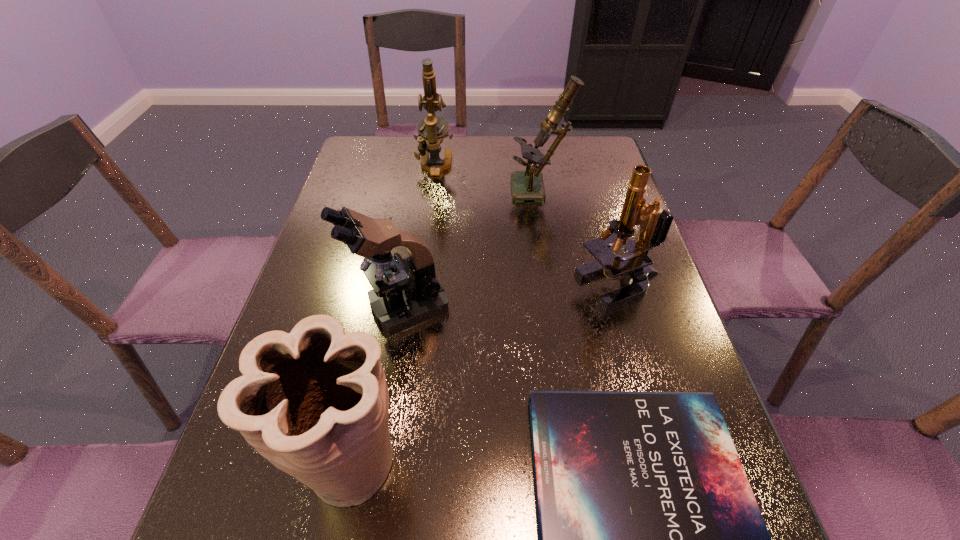
Locate an element on the screen. This screenshot has height=540, width=960. urn is located at coordinates (314, 402).

The height and width of the screenshot is (540, 960). Find the location of `vacant space situated on the right of the urn`. vacant space situated on the right of the urn is located at coordinates (625, 462).

You are a GUI agent. You are given a task and a screenshot of the screen. Output one action in this format:
    pyautogui.click(x=<x>, y=<y>)
    Task: Click on the object at the far edge
    The image size is (960, 540).
    Given the screenshot: What is the action you would take?
    pyautogui.click(x=432, y=129)

Locate an element on the screen. object situated at the near edge is located at coordinates (314, 402).

Find the location of a particular element. The height and width of the screenshot is (540, 960). microscope present at the left edge is located at coordinates (412, 295).

This screenshot has width=960, height=540. I want to click on urn that is at the left edge, so click(314, 402).

This screenshot has width=960, height=540. I want to click on object present at the right edge, so click(x=635, y=266).

You are a GUI agent. You are given a task and a screenshot of the screen. Output one action in this format:
    pyautogui.click(x=<x>, y=<y>)
    Task: Click on the object that is at the near left corner
    
    Given the screenshot: What is the action you would take?
    pyautogui.click(x=314, y=402)

In the image, there is a desktop. At what (x,y) coordinates should I click in order to perform the action: click on free space at the far edge. Please return your answer as a coordinate pair (x, y). Looking at the image, I should click on (554, 163).

You are a GUI agent. You are given a task and a screenshot of the screen. Output one action in this format:
    pyautogui.click(x=<x>, y=<y>)
    Task: Click on the vacant area at the left edge
    This screenshot has width=960, height=540.
    Given the screenshot: What is the action you would take?
    [224, 477]